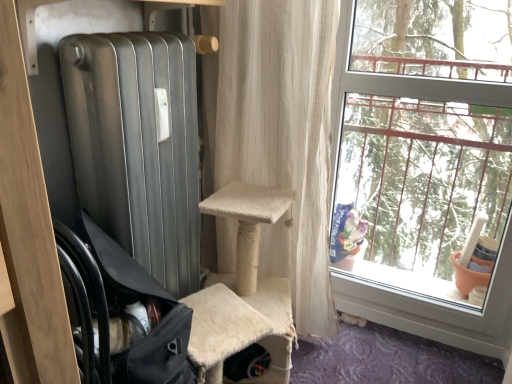
Question: From a real-world perspective, is black fabric chair at left over white textured curtain at center?

Choices:
 (A) no
 (B) yes

Answer: (A)

Question: Is black fabric chair at left positioned with its back to white textured curtain at center?

Choices:
 (A) no
 (B) yes

Answer: (A)

Question: Is the position of black fabric chair at left more distant than that of white textured curtain at center?

Choices:
 (A) no
 (B) yes

Answer: (A)

Question: Is black fabric chair at left positioned beyond the bounds of white textured curtain at center?

Choices:
 (A) no
 (B) yes

Answer: (B)

Question: Are black fabric chair at left and white textured curtain at center located far from each other?

Choices:
 (A) no
 (B) yes

Answer: (A)

Question: Does black fabric chair at left have a smaller size compared to white textured curtain at center?

Choices:
 (A) yes
 (B) no

Answer: (A)

Question: Could you tell me if clear glass window at right is turned towards white textured curtain at center?

Choices:
 (A) yes
 (B) no

Answer: (B)

Question: Considering the relative sizes of clear glass window at right and white textured curtain at center in the image provided, is clear glass window at right wider than white textured curtain at center?

Choices:
 (A) no
 (B) yes

Answer: (A)

Question: Is clear glass window at right to the right of white textured curtain at center from the viewer's perspective?

Choices:
 (A) yes
 (B) no

Answer: (A)

Question: Is clear glass window at right with white textured curtain at center?

Choices:
 (A) yes
 (B) no

Answer: (B)

Question: Can you confirm if clear glass window at right is shorter than white textured curtain at center?

Choices:
 (A) no
 (B) yes

Answer: (A)

Question: Considering the relative sizes of clear glass window at right and white textured curtain at center in the image provided, is clear glass window at right thinner than white textured curtain at center?

Choices:
 (A) no
 (B) yes

Answer: (B)

Question: From the image's perspective, is clear glass window at right under black fabric chair at left?

Choices:
 (A) no
 (B) yes

Answer: (A)